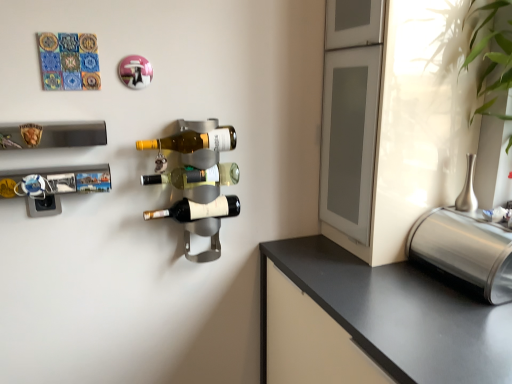
Find the location of a particular element. empty space that is ontop of translucent glass bottle at center, which is the second beer bottle from top to bottom is located at coordinates (199, 164).